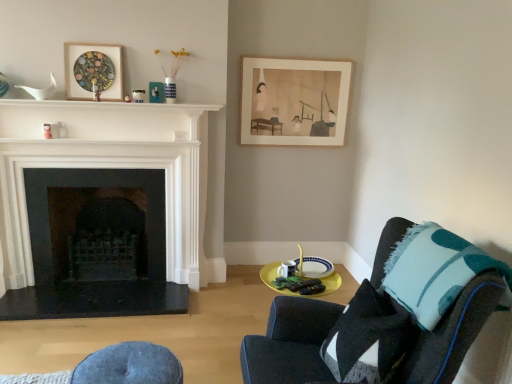
This screenshot has width=512, height=384. I want to click on vacant space to the right of matte black picture frame at upper center, which is the second picture frame from left to right, so click(175, 108).